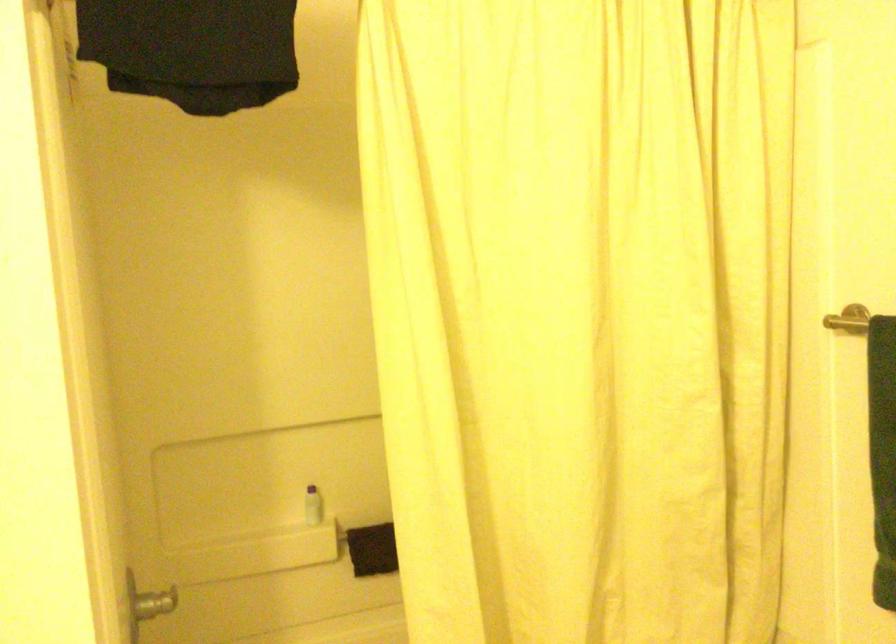
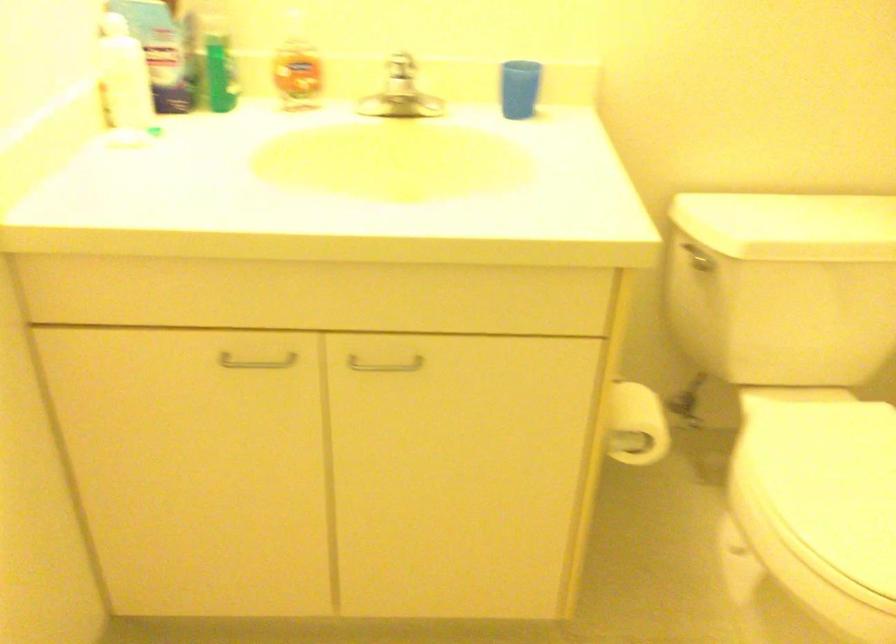
The first image is from the beginning of the video and the second image is from the end. How did the camera likely rotate when shooting the video?

The camera's rotation is toward left-down.